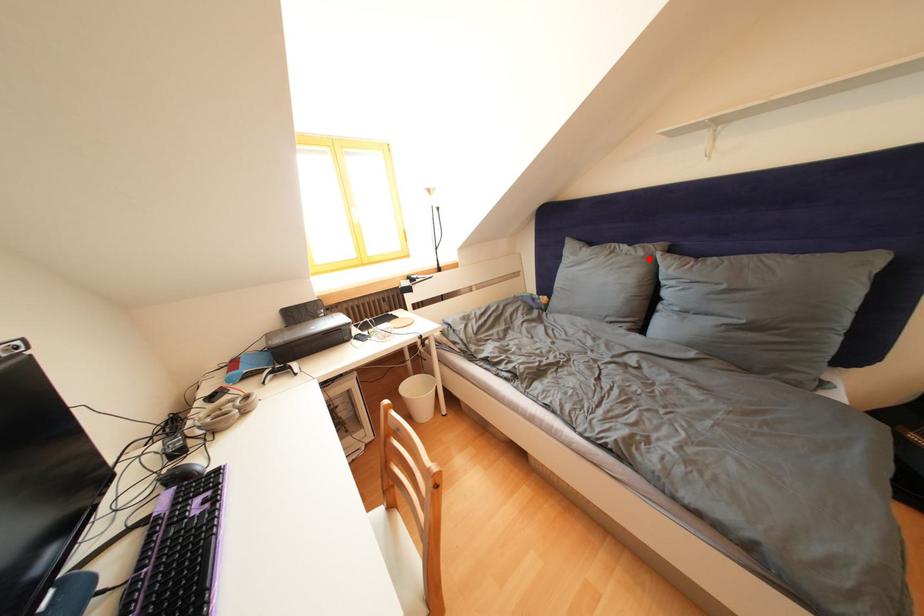
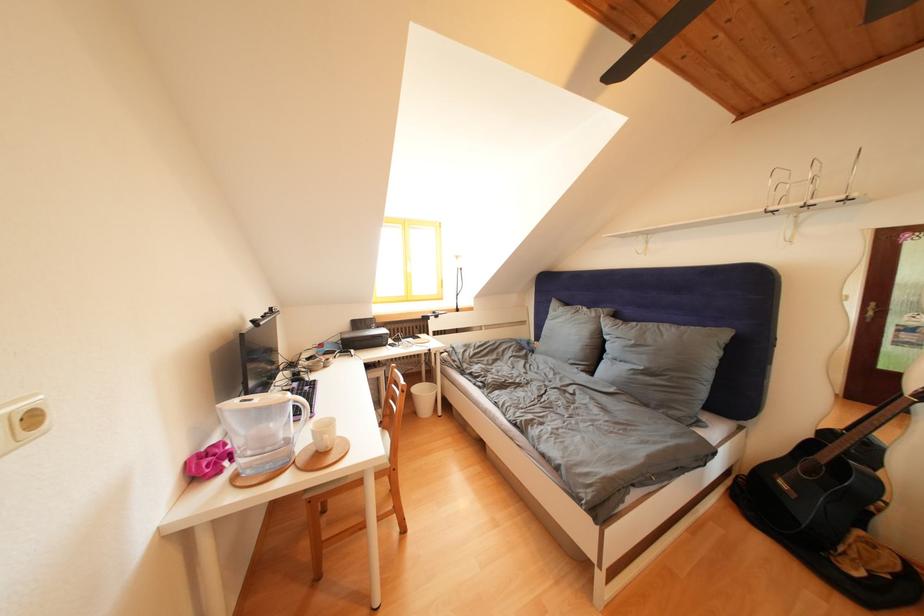
Find the pixel in the second image that matches the highlighted location in the first image.

(602, 320)